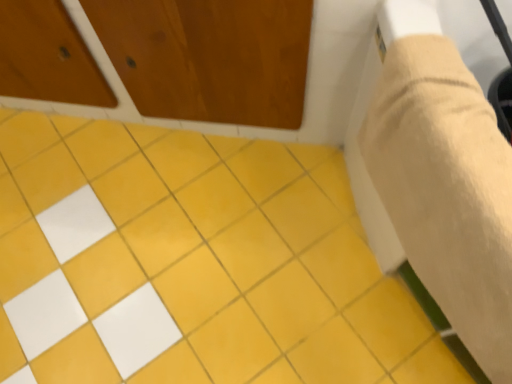
Question: From the image's perspective, relative to beige fabric plaster bandage at right, is yellow matte tile at center above or below?

Choices:
 (A) above
 (B) below

Answer: (B)

Question: Considering the positions of yellow matte tile at center and beige fabric plaster bandage at right in the image, is yellow matte tile at center wider or thinner than beige fabric plaster bandage at right?

Choices:
 (A) thin
 (B) wide

Answer: (B)

Question: From their relative heights in the image, would you say yellow matte tile at center is taller or shorter than beige fabric plaster bandage at right?

Choices:
 (A) tall
 (B) short

Answer: (B)

Question: In terms of height, does beige fabric plaster bandage at right look taller or shorter compared to yellow matte tile at center?

Choices:
 (A) short
 (B) tall

Answer: (B)

Question: Is beige fabric plaster bandage at right situated inside yellow matte tile at center or outside?

Choices:
 (A) inside
 (B) outside

Answer: (B)

Question: Considering the positions of point (403, 205) and point (148, 248), is point (403, 205) closer or farther from the camera than point (148, 248)?

Choices:
 (A) closer
 (B) farther

Answer: (A)

Question: From a real-world perspective, is beige fabric plaster bandage at right positioned above or below yellow matte tile at center?

Choices:
 (A) below
 (B) above

Answer: (B)